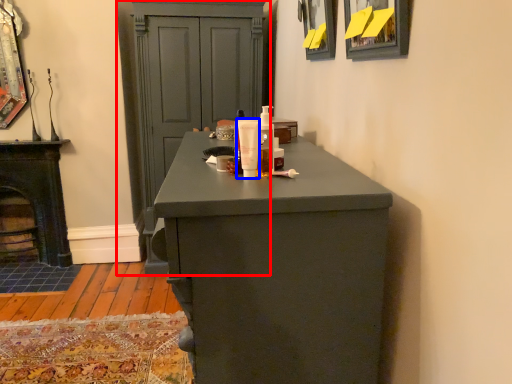
Question: Among these objects, which one is nearest to the camera, cupboard (highlighted by a red box) or mouthwash (highlighted by a blue box)?

Choices:
 (A) cupboard
 (B) mouthwash

Answer: (B)